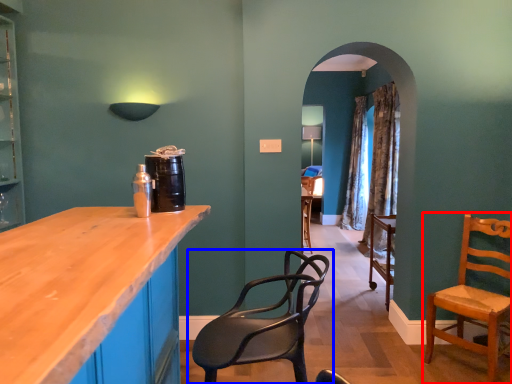
Question: Which object is closer to the camera taking this photo, chair (highlighted by a red box) or chair (highlighted by a blue box)?

Choices:
 (A) chair
 (B) chair

Answer: (B)